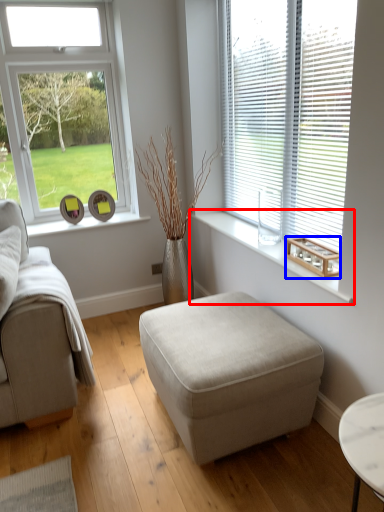
Question: Which of the following is the closest to the observer, window sill (highlighted by a red box) or wood (highlighted by a blue box)?

Choices:
 (A) window sill
 (B) wood

Answer: (A)